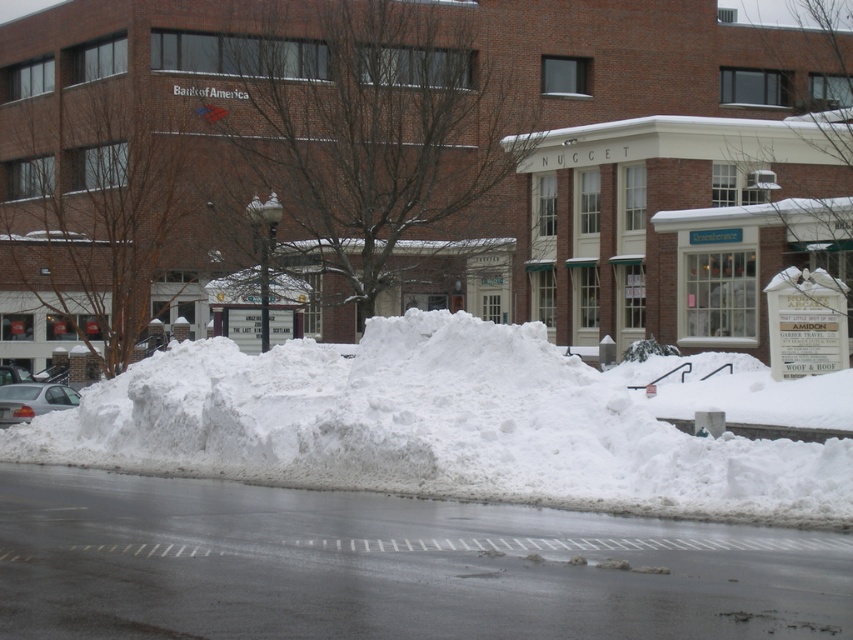
Question: Does white fluffy snow at center appear over silver metallic sedan at lower left?

Choices:
 (A) yes
 (B) no

Answer: (A)

Question: Which object appears closest to the camera in this image?

Choices:
 (A) white fluffy snow at center
 (B) silver metallic sedan at lower left

Answer: (A)

Question: Which object appears closest to the camera in this image?

Choices:
 (A) silver metallic sedan at lower left
 (B) white fluffy snow at center

Answer: (B)

Question: Does white fluffy snow at center appear on the left side of silver metallic sedan at lower left?

Choices:
 (A) no
 (B) yes

Answer: (A)

Question: Does white fluffy snow at center appear on the right side of silver metallic sedan at lower left?

Choices:
 (A) no
 (B) yes

Answer: (B)